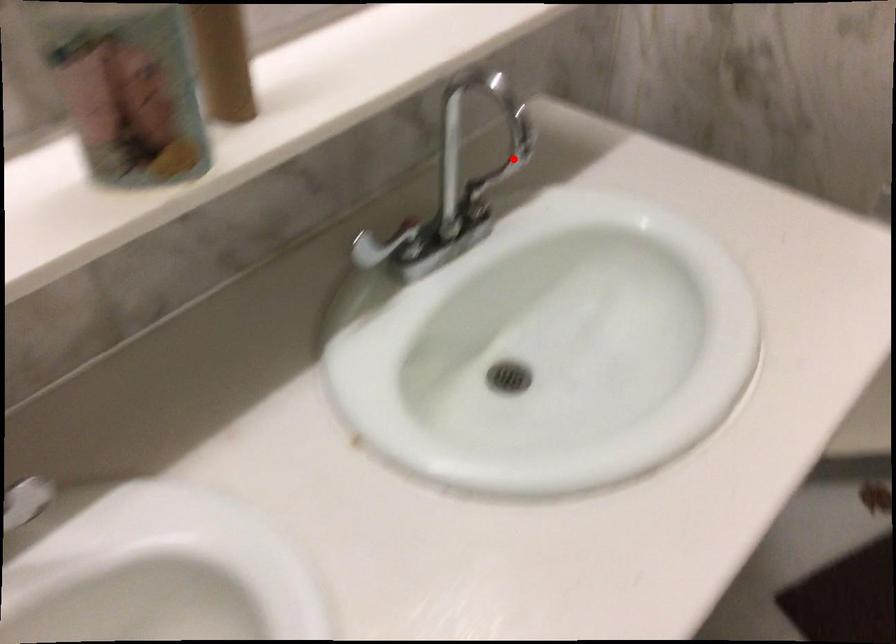
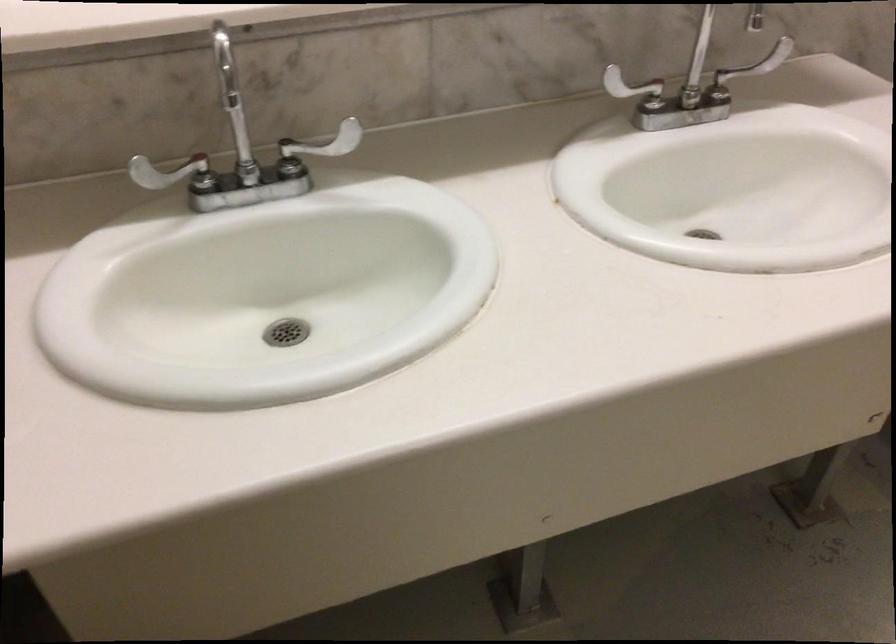
Question: I am providing you with two images of the same scene from different viewpoints. A red point is shown in image1. For the corresponding object point in image2, is it positioned nearer or farther from the camera?

Choices:
 (A) Nearer
 (B) Farther

Answer: (B)